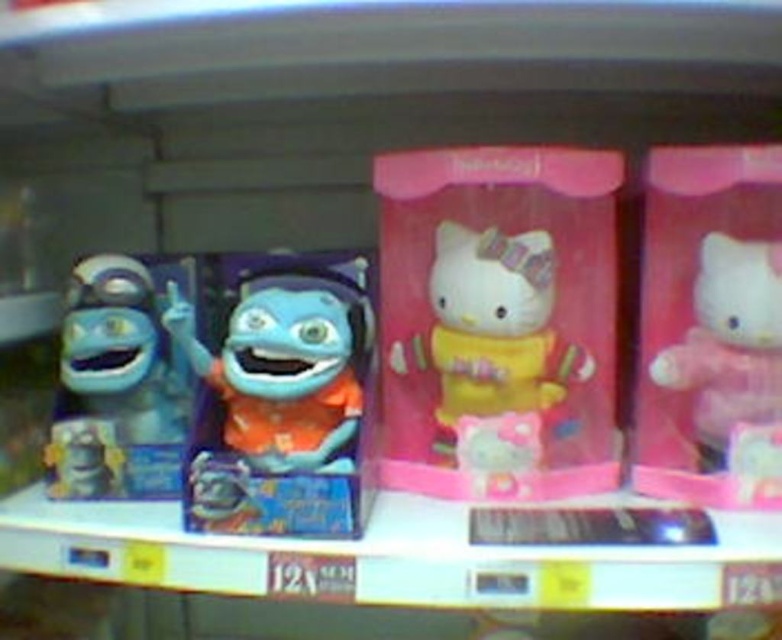
Question: Is yellow matte hello kitty at center bigger than pink plush toy at right?

Choices:
 (A) no
 (B) yes

Answer: (B)

Question: Can you confirm if matte blue plush at center is positioned to the right of matte blue plush toy at left?

Choices:
 (A) yes
 (B) no

Answer: (A)

Question: Is yellow matte hello kitty at center below pink plush toy at right?

Choices:
 (A) no
 (B) yes

Answer: (A)

Question: Which is nearer to the matte blue plush at center?

Choices:
 (A) pink plush toy at right
 (B) yellow matte hello kitty at center
 (C) matte blue plush toy at left

Answer: (B)

Question: Which object appears farthest from the camera in this image?

Choices:
 (A) matte blue plush toy at left
 (B) pink plush toy at right
 (C) matte blue plush at center
 (D) yellow matte hello kitty at center

Answer: (A)

Question: Among these points, which one is nearest to the camera?

Choices:
 (A) (476, 326)
 (B) (755, 390)

Answer: (B)